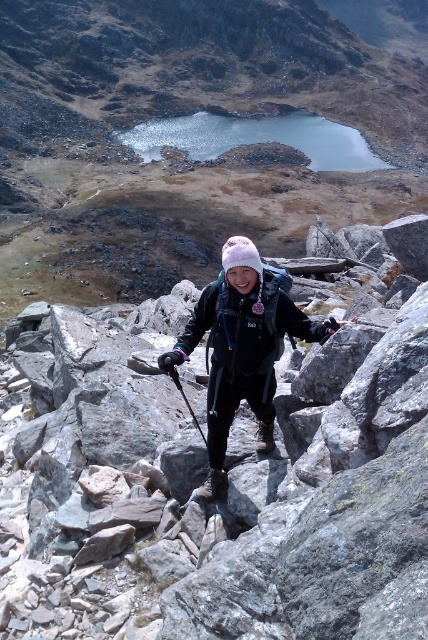
Question: Is blue glassy lake at upper center further to the viewer compared to black rubber ski pole at center?

Choices:
 (A) yes
 (B) no

Answer: (A)

Question: Estimate the real-world distances between objects in this image. Which object is farther from the matte black jacket at center?

Choices:
 (A) matte black backpack at center
 (B) blue glassy lake at upper center

Answer: (A)

Question: Can you confirm if matte black jacket at center is wider than black rubber ski pole at center?

Choices:
 (A) yes
 (B) no

Answer: (A)

Question: Which object is closer to the camera taking this photo?

Choices:
 (A) matte black backpack at center
 (B) black rubber ski pole at center
 (C) blue glassy lake at upper center

Answer: (B)

Question: Does matte black backpack at center have a lesser width compared to blue glassy lake at upper center?

Choices:
 (A) yes
 (B) no

Answer: (B)

Question: Which object is the farthest from the matte black jacket at center?

Choices:
 (A) blue glassy lake at upper center
 (B) matte black backpack at center
 (C) black rubber ski pole at center

Answer: (B)